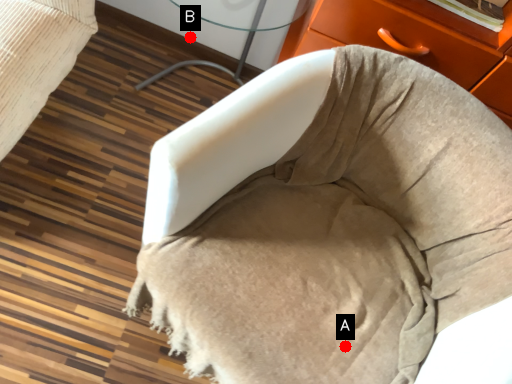
Question: Two points are circled on the image, labeled by A and B beside each circle. Which point is farther from the camera taking this photo?

Choices:
 (A) A is further
 (B) B is further

Answer: (B)